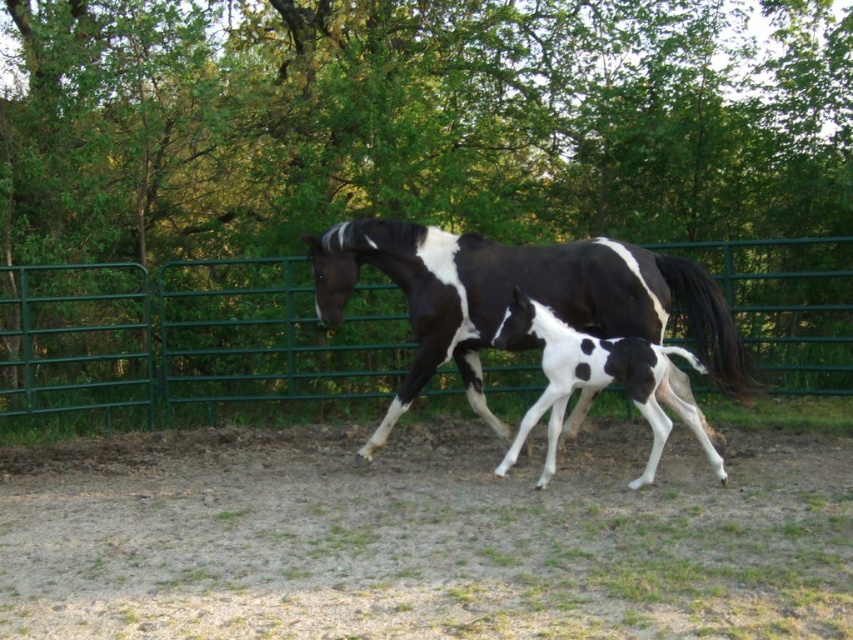
You are a visitor at a horse ranch and want to take a photo of the black and white speckled horse at center without the green metal fence at center appearing in the shot. How can you position yourself to achieve this?

The black and white speckled horse at center is behind the green metal fence at center. To take a photo without the fence, position yourself so that you are between the horse and the fence, ensuring the fence is out of the frame.